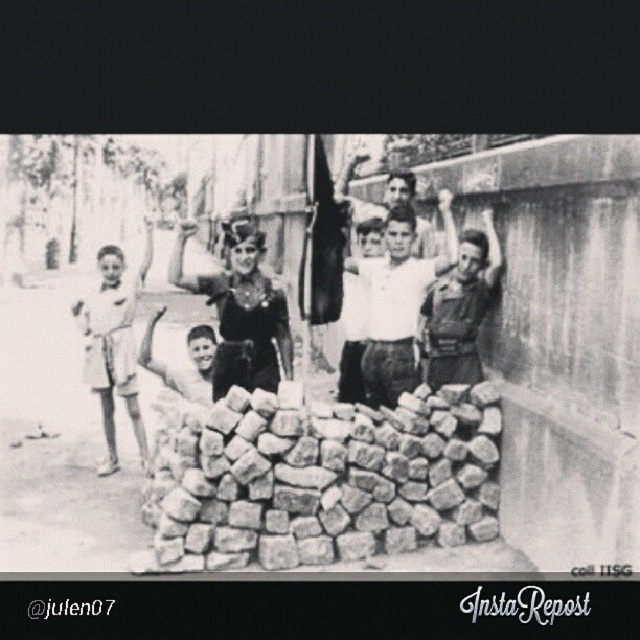
You are a photographer who needs to capture a closeup shot of both the white cotton shirt at center and the matte black uniform at right without moving either subject. Given that your camera has a maximum focus range of 18 inches, will you be able to capture both subjects in sharp focus?

The white cotton shirt at center and matte black uniform at right are 18.89 inches apart from each other, which exceeds the camera maximum focus range of 18 inches. Therefore, you cannot capture both subjects in sharp focus without moving them.

You are a photographer who wants to capture a closeup of the light beige shorts at left and the smooth skin boy at center in the same frame. Given that your camera has a maximum focus range of 4 meters, will you be able to achieve this?

Answer: The light beige shorts at left and the smooth skin boy at center are 4.59 meters apart. Since the distance between them exceeds the camera maximum focus range of 4 meters, you won not be able to capture both in the same frame with clear focus.